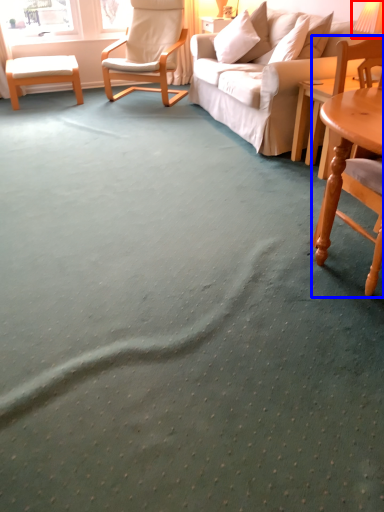
Question: Which object appears farthest to the camera in this image, table lamp (highlighted by a red box) or chair (highlighted by a blue box)?

Choices:
 (A) table lamp
 (B) chair

Answer: (A)